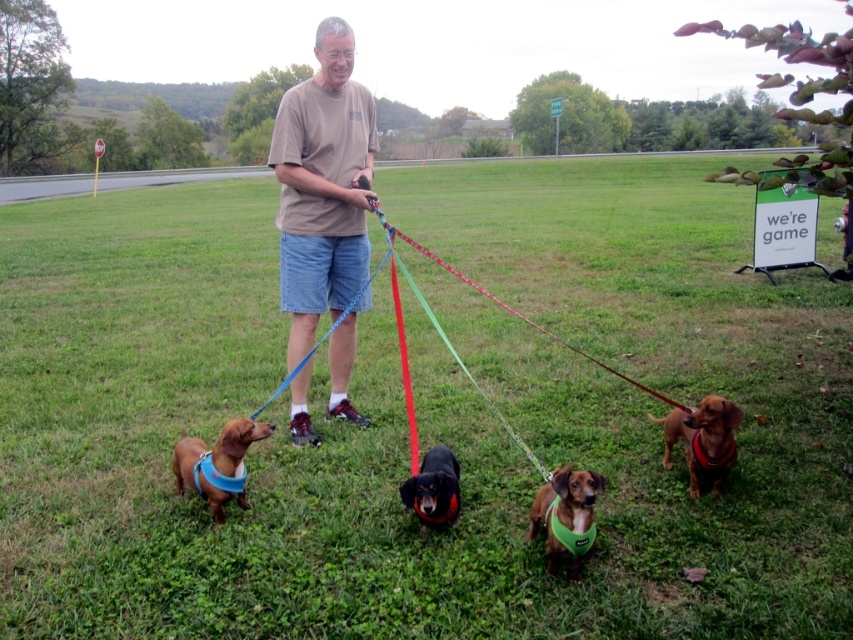
Between brown fabric dog at lower left and red nylon leash at center, which one has more height?

red nylon leash at center is taller.

Does brown fabric dog at lower left have a greater width compared to red nylon leash at center?

Yes, brown fabric dog at lower left is wider than red nylon leash at center.

Which is in front, point (235, 449) or point (462, 364)?

Point (235, 449)

Where is `brown fabric dog at lower left`? This screenshot has height=640, width=853. brown fabric dog at lower left is located at coordinates (218, 464).

Can you confirm if brown fabric dog at lower left is positioned above black smooth dachshund at center?

Correct, brown fabric dog at lower left is located above black smooth dachshund at center.

Does brown fabric dog at lower left have a larger size compared to black smooth dachshund at center?

Indeed, brown fabric dog at lower left has a larger size compared to black smooth dachshund at center.

The image size is (853, 640). I want to click on brown fabric dog at lower left, so click(218, 464).

Does brown fabric dog at lower left appear on the left side of brown fabric dog at lower right?

Yes, brown fabric dog at lower left is to the left of brown fabric dog at lower right.

Is point (218, 472) positioned in front of point (670, 426)?

Yes, point (218, 472) is in front of point (670, 426).

This screenshot has width=853, height=640. In order to click on brown fabric dog at lower left in this screenshot , I will do `click(218, 464)`.

The height and width of the screenshot is (640, 853). Find the location of `brown fabric dog at lower left`. brown fabric dog at lower left is located at coordinates (218, 464).